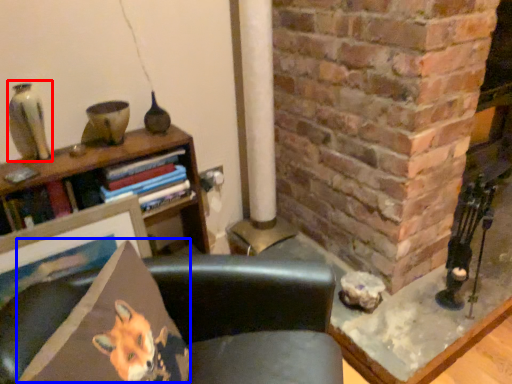
Question: Among these objects, which one is farthest to the camera, gray (highlighted by a red box) or throw pillow (highlighted by a blue box)?

Choices:
 (A) gray
 (B) throw pillow

Answer: (A)